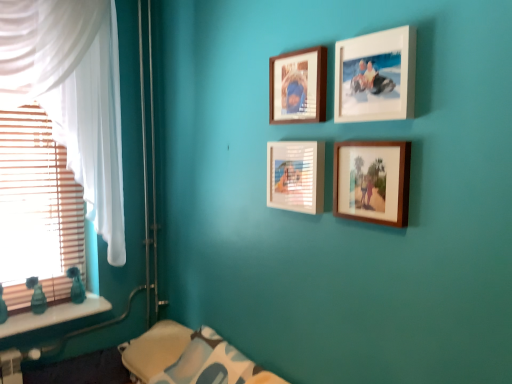
Question: From a real-world perspective, relative to white sheer curtain at left, is white glossy picture frame at center, acting as the 3th picture frame starting from the top, vertically above or below?

Choices:
 (A) below
 (B) above

Answer: (A)

Question: Is point (278, 168) closer or farther from the camera than point (61, 6)?

Choices:
 (A) closer
 (B) farther

Answer: (A)

Question: Which of these objects is positioned closest to the wooden frame at upper center, the fourth picture frame from the bottom?

Choices:
 (A) soft white fabric pillow at lower center
 (B) white glossy picture frame at center, acting as the 3th picture frame starting from the top
 (C) white matte picture frame at upper center, the third picture frame ordered from the bottom
 (D) white sheer curtain at left
 (E) white marble window sill at lower left

Answer: (C)

Question: Based on their relative distances, which object is farther from the white matte picture frame at upper center, the third picture frame ordered from the bottom?

Choices:
 (A) white sheer curtain at left
 (B) wooden blinds at left
 (C) soft white fabric pillow at lower center
 (D) white marble window sill at lower left
 (E) white glossy picture frame at center, acting as the 3th picture frame starting from the top

Answer: (D)